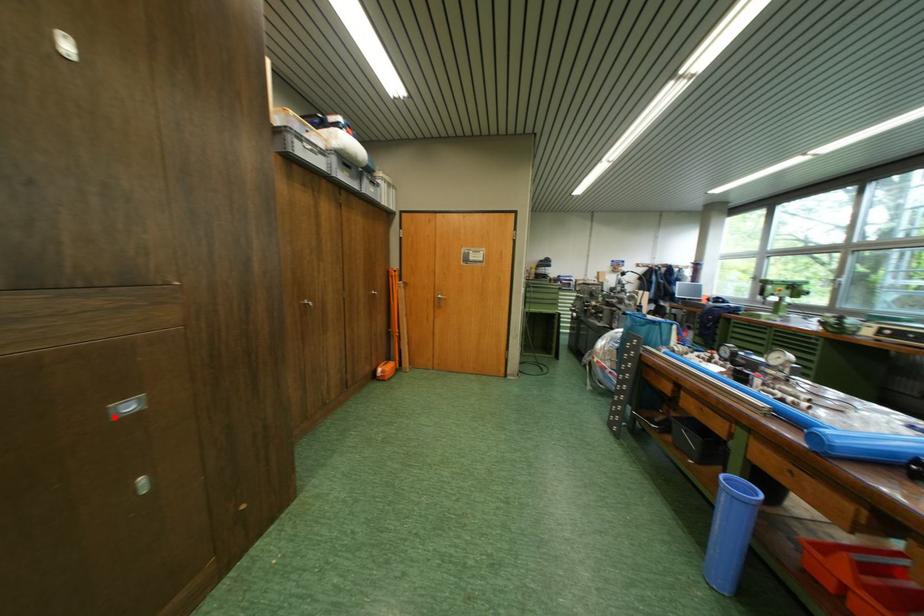
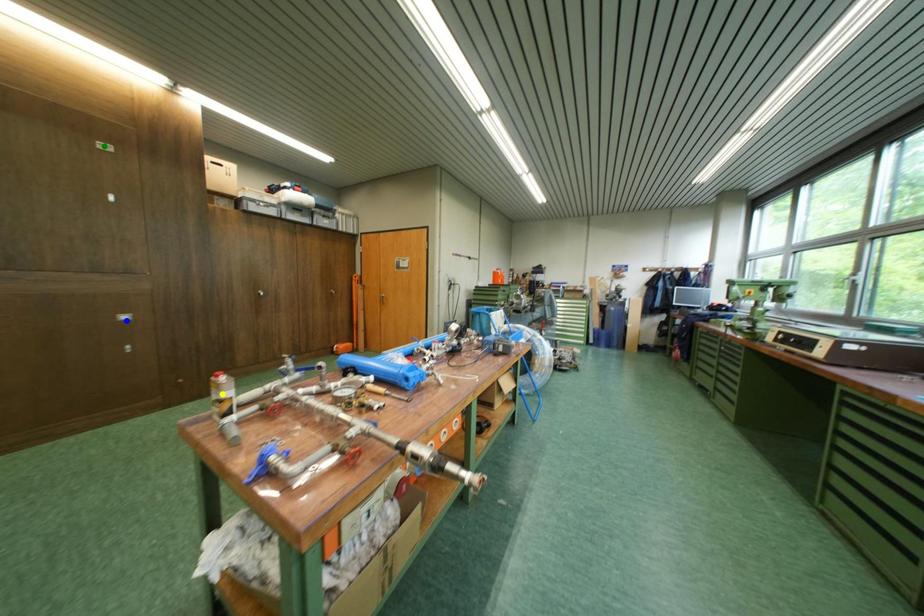
Question: I am providing you with two images of the same scene from different viewpoints. A red point is marked on the first image. You are given multiple points on the second image. Can you choose the point in image 2 that corresponds to the point in image 1?

Choices:
 (A) blue point
 (B) green point
 (C) yellow point

Answer: (A)